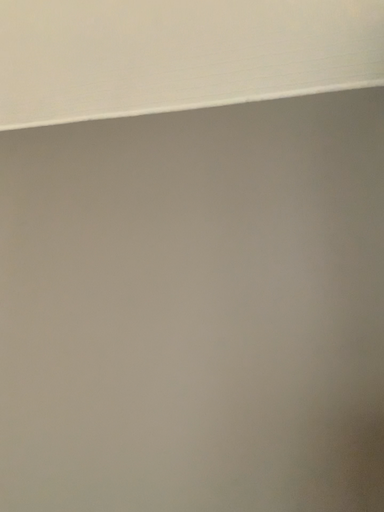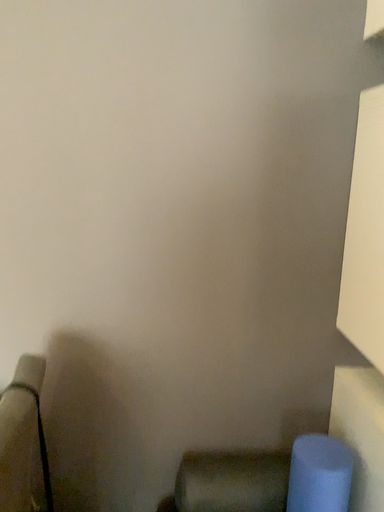
Question: How did the camera likely rotate when shooting the video?

Choices:
 (A) rotated right
 (B) rotated left

Answer: (A)